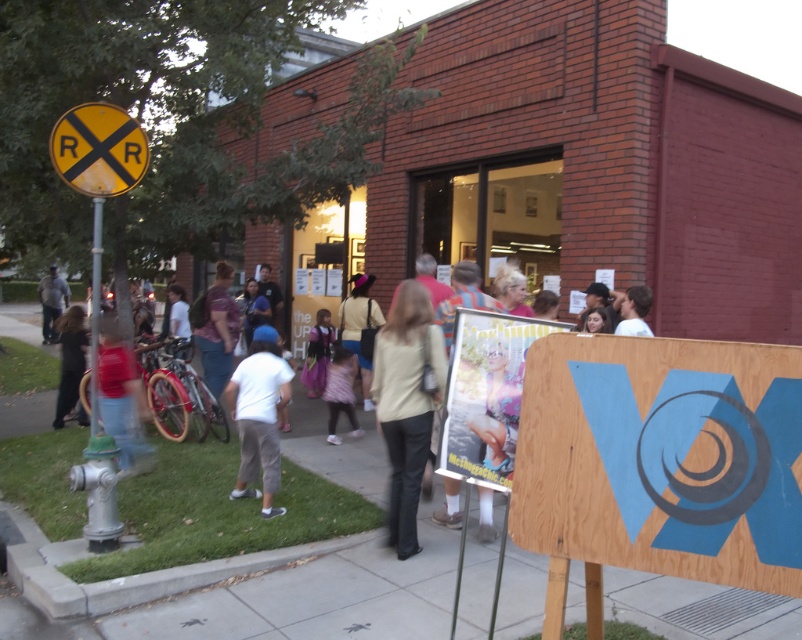
Who is taller, wooden signboard at center-right or matte red shirt at center?

Standing taller between the two is matte red shirt at center.

Does wooden signboard at center-right lie in front of matte red shirt at center?

Yes.

Is point (537, 544) less distant than point (148, 410)?

Yes, point (537, 544) is in front of point (148, 410).

What are the coordinates of `wooden signboard at center-right` in the screenshot? It's located at (663, 458).

Looking at this image, does dark gray pants at lower left have a larger size compared to light pink fabric dress at center?

Yes, dark gray pants at lower left is bigger than light pink fabric dress at center.

Is dark gray pants at lower left below light pink fabric dress at center?

No, dark gray pants at lower left is not below light pink fabric dress at center.

Which is behind, point (69, 408) or point (327, 420)?

The point (69, 408) is more distant.

In order to click on dark gray pants at lower left in this screenshot , I will do `click(69, 360)`.

Which is above, dark gray pants at lower left or white cotton shirt at lower left?

dark gray pants at lower left

Does dark gray pants at lower left have a greater width compared to white cotton shirt at lower left?

Yes, dark gray pants at lower left is wider than white cotton shirt at lower left.

Is point (75, 387) farther from viewer compared to point (314, 416)?

No, it is not.

I want to click on dark gray pants at lower left, so point(69,360).